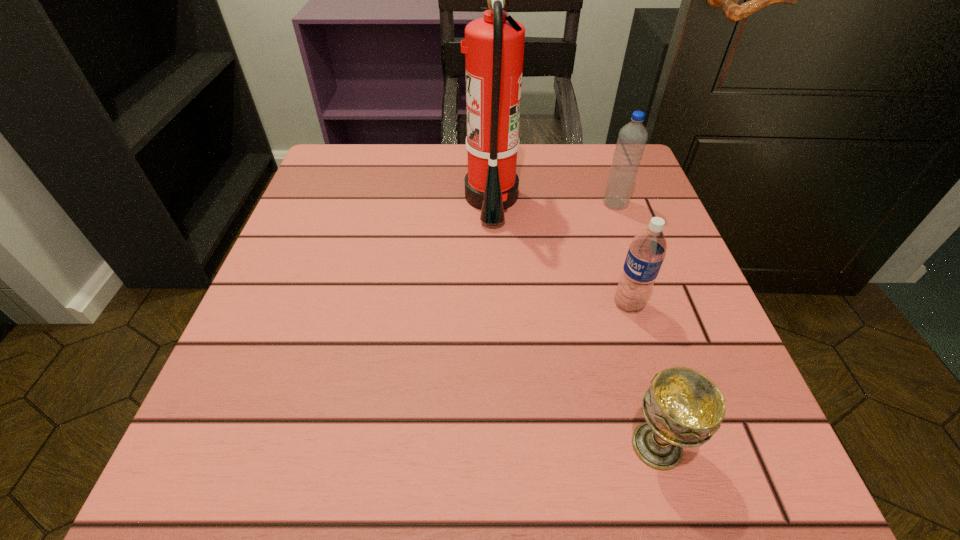
Where is `vacant position located 0.120m on the left of the third farthest object`? vacant position located 0.120m on the left of the third farthest object is located at coordinates (541, 303).

What are the coordinates of `vacant space positioned 0.170m on the left of the nearest object` in the screenshot? It's located at (492, 446).

Where is `fire extinguisher that is at the far edge`? The image size is (960, 540). fire extinguisher that is at the far edge is located at coordinates (493, 46).

Find the location of a particular element. This screenshot has width=960, height=540. water bottle that is at the far edge is located at coordinates (632, 138).

This screenshot has height=540, width=960. Identify the location of object at the near edge. (683, 408).

You are a GUI agent. You are given a task and a screenshot of the screen. Output one action in this format:
    pyautogui.click(x=<x>, y=<y>)
    Task: Click on the chalice present at the right edge
    The image size is (960, 540).
    Given the screenshot: What is the action you would take?
    pyautogui.click(x=683, y=408)

Find the location of a particular element. Image resolution: width=960 pixels, height=540 pixels. object situated at the far right corner is located at coordinates (632, 138).

Image resolution: width=960 pixels, height=540 pixels. I want to click on object that is at the near right corner, so click(683, 408).

You are a GUI agent. You are given a task and a screenshot of the screen. Output one action in this format:
    pyautogui.click(x=<x>, y=<y>)
    Task: Click on the free space at the near edge of the desktop
    The width and height of the screenshot is (960, 540).
    Given the screenshot: What is the action you would take?
    pyautogui.click(x=598, y=492)

In the image, there is a desktop. Where is `vacant space at the left edge`? This screenshot has height=540, width=960. vacant space at the left edge is located at coordinates (288, 318).